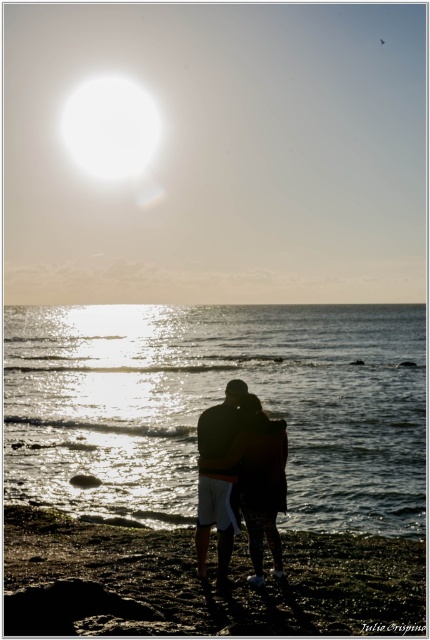
Question: Which of the following is the closest to the observer?

Choices:
 (A) glistening water at center
 (B) smooth sand at lower center

Answer: (B)

Question: Does glistening water at center have a lesser width compared to smooth sand at lower center?

Choices:
 (A) yes
 (B) no

Answer: (B)

Question: Which point is farther from the camera taking this photo?

Choices:
 (A) (420, 614)
 (B) (338, 426)
 (C) (264, 531)

Answer: (B)

Question: Can you confirm if glistening water at center is positioned above smooth sand at lower center?

Choices:
 (A) no
 (B) yes

Answer: (B)

Question: Can you confirm if glistening water at center is bigger than smooth sand at lower center?

Choices:
 (A) yes
 (B) no

Answer: (A)

Question: Which object is farther from the camera taking this photo?

Choices:
 (A) silhouette fabric couple at center
 (B) smooth sand at lower center
 (C) glistening water at center

Answer: (C)